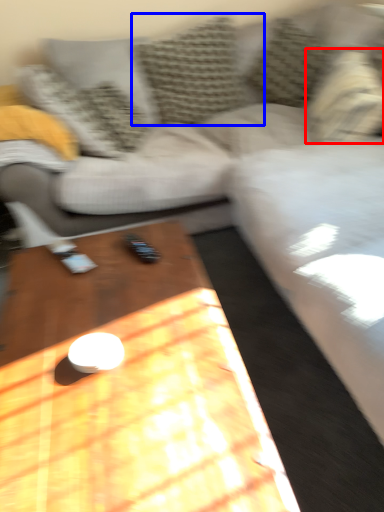
Question: Among these objects, which one is nearest to the camera, pillow (highlighted by a red box) or pillow (highlighted by a blue box)?

Choices:
 (A) pillow
 (B) pillow

Answer: (A)